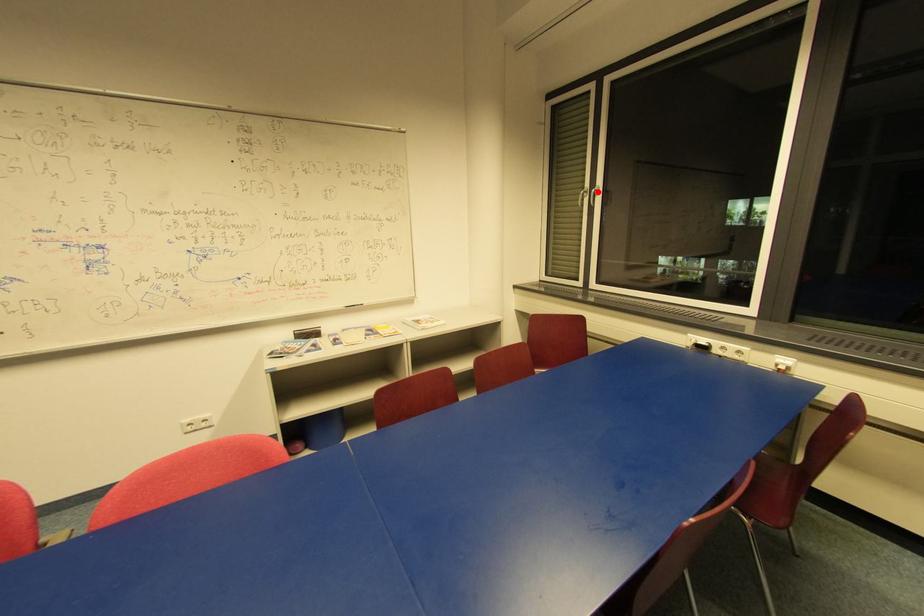
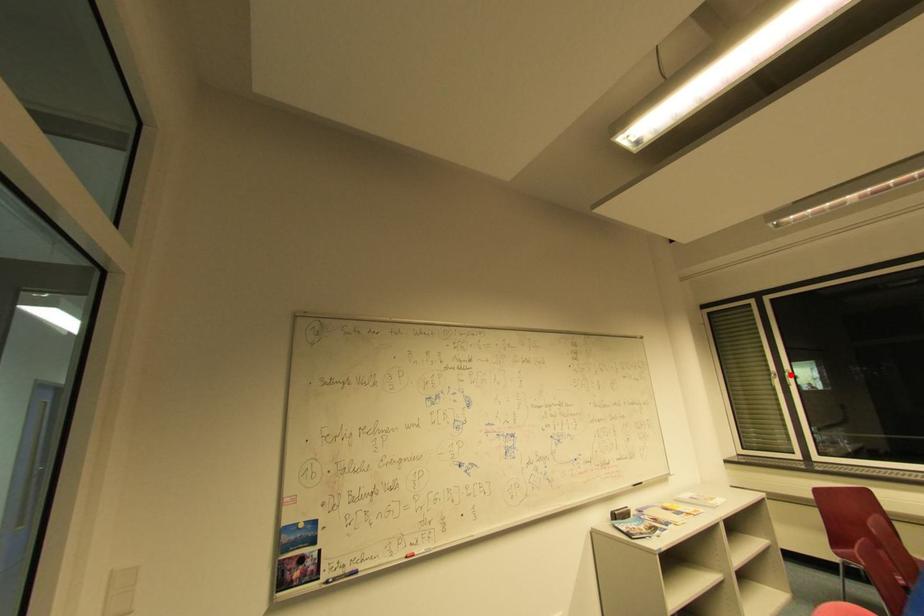
I am providing you with two images of the same scene from different viewpoints. A red point is marked on the first image and another point is marked on the second image. Do the highlighted points in image1 and image2 indicate the same real-world spot?

Yes